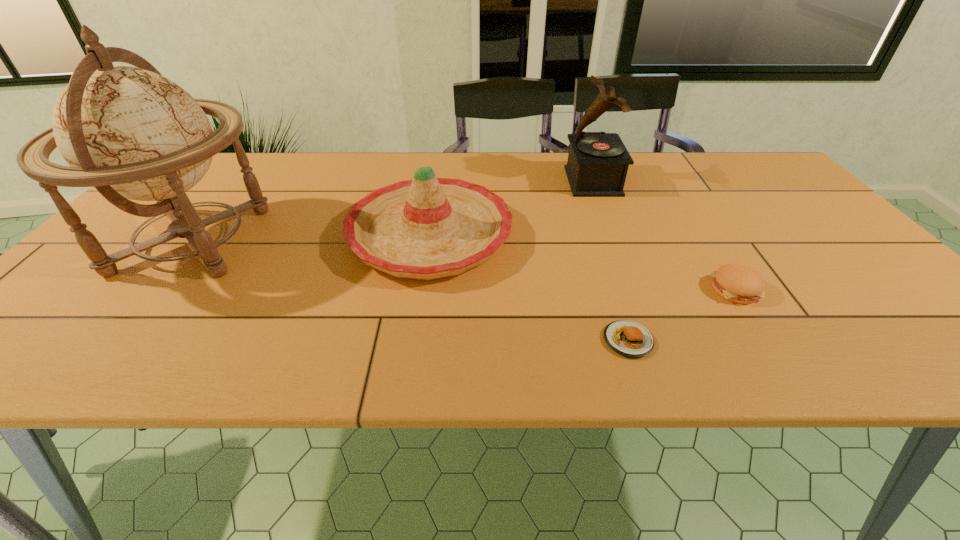
Find the location of a particular element. The image size is (960, 540). free spot that satisfies the following two spatial constraints: 1. at the front of the globe showing Africa; 2. on the back side of the nearer food is located at coordinates (110, 340).